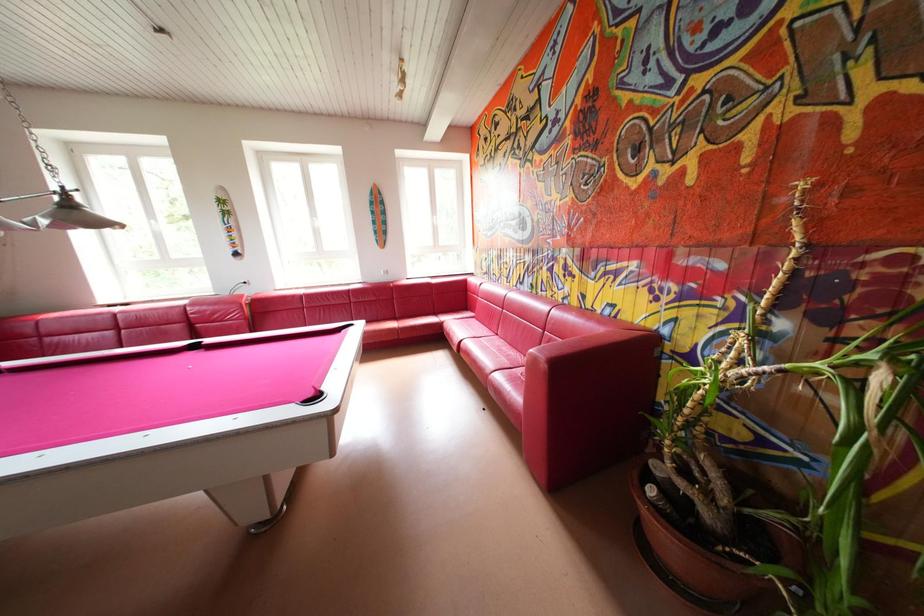
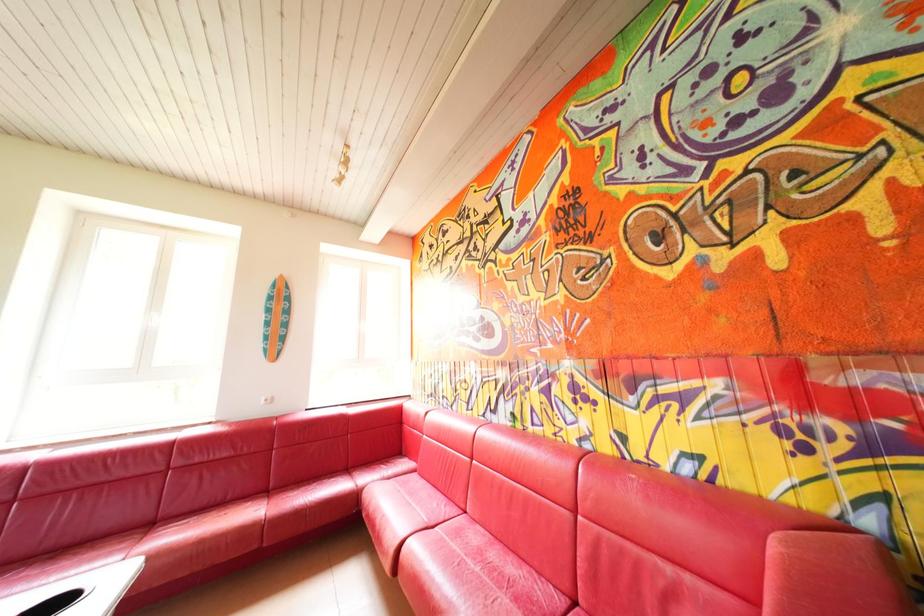
How did the camera likely rotate?

The camera's rotation is toward right-up.